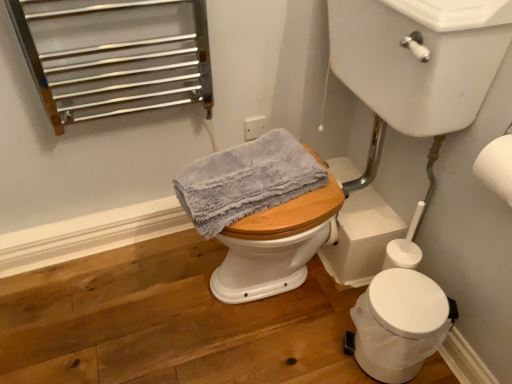
Question: Is white matte toilet paper at upper right spatially inside gray textured towel at center, or outside of it?

Choices:
 (A) outside
 (B) inside

Answer: (A)

Question: In terms of size, does white matte toilet paper at upper right appear bigger or smaller than gray textured towel at center?

Choices:
 (A) big
 (B) small

Answer: (B)

Question: Which is farther from the gray textured towel at center?

Choices:
 (A) white matte toilet paper at upper right
 (B) white glossy sink at upper right
 (C) white plastic trash can at lower right

Answer: (A)

Question: Estimate the real-world distances between objects in this image. Which object is closer to the white matte toilet paper at upper right?

Choices:
 (A) white plastic trash can at lower right
 (B) white glossy sink at upper right
 (C) gray textured towel at center

Answer: (B)